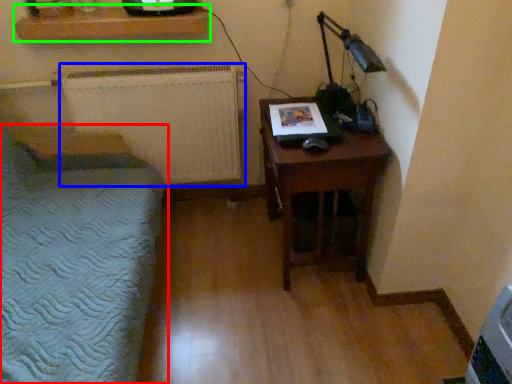
Question: Which is farther away from furniture (highlighted by a red box)? radiator (highlighted by a blue box) or shelf (highlighted by a green box)?

Choices:
 (A) radiator
 (B) shelf

Answer: (B)